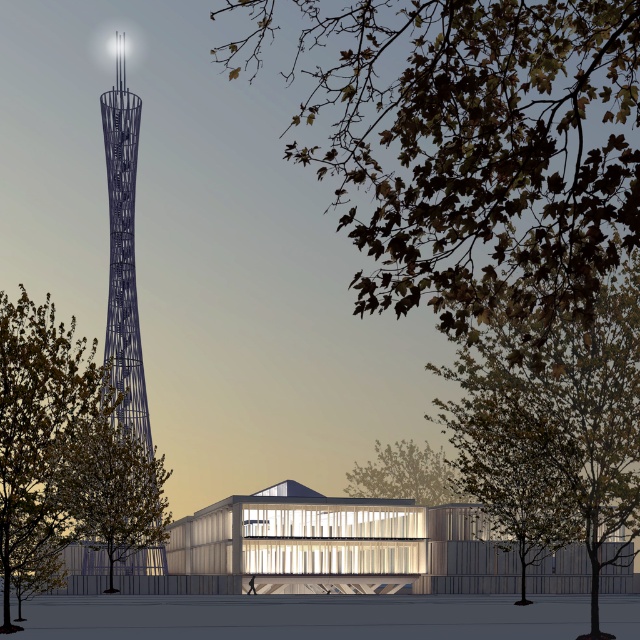
You are standing at point (65, 456) in the scene. What object is located at this point?

The green leafy tree at left is located at point (65, 456).

You are standing in front of the modern architectural scene and want to take a photo that includes both point A at point (516, 499) and point B at point (109, 200). Which point will appear larger in the photo?

Point A at point (516, 499) will appear larger in the photo because it is closer to the camera than point B at point (109, 200).